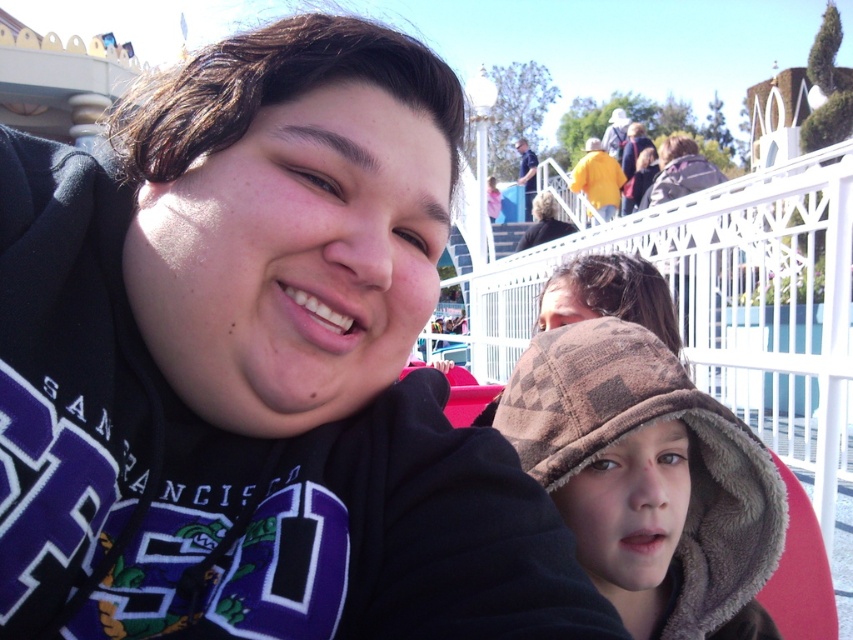
Is brown fleece hat at center above dark brown hair at upper center?

Actually, brown fleece hat at center is below dark brown hair at upper center.

Does brown fleece hat at center appear under dark brown hair at upper center?

Correct, brown fleece hat at center is located below dark brown hair at upper center.

Does point (592, 452) come farther from viewer compared to point (555, 234)?

No, it is not.

The image size is (853, 640). I want to click on brown fleece hat at center, so click(x=648, y=480).